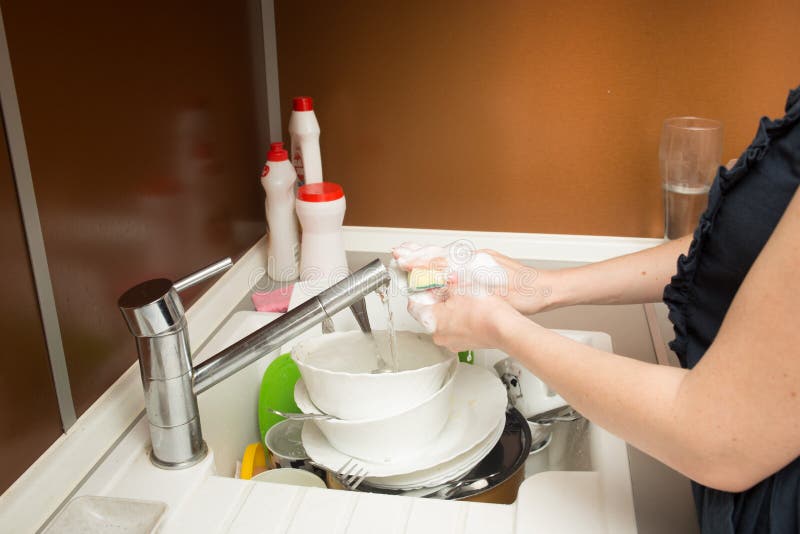
You are a GUI agent. You are given a task and a screenshot of the screen. Output one action in this format:
    pyautogui.click(x=<x>, y=<y>)
    Task: Click on the white dishes
    Image resolution: width=800 pixels, height=534 pixels.
    Given the screenshot: What is the action you would take?
    pyautogui.click(x=366, y=384), pyautogui.click(x=389, y=423), pyautogui.click(x=478, y=433), pyautogui.click(x=478, y=453), pyautogui.click(x=541, y=397), pyautogui.click(x=294, y=477)